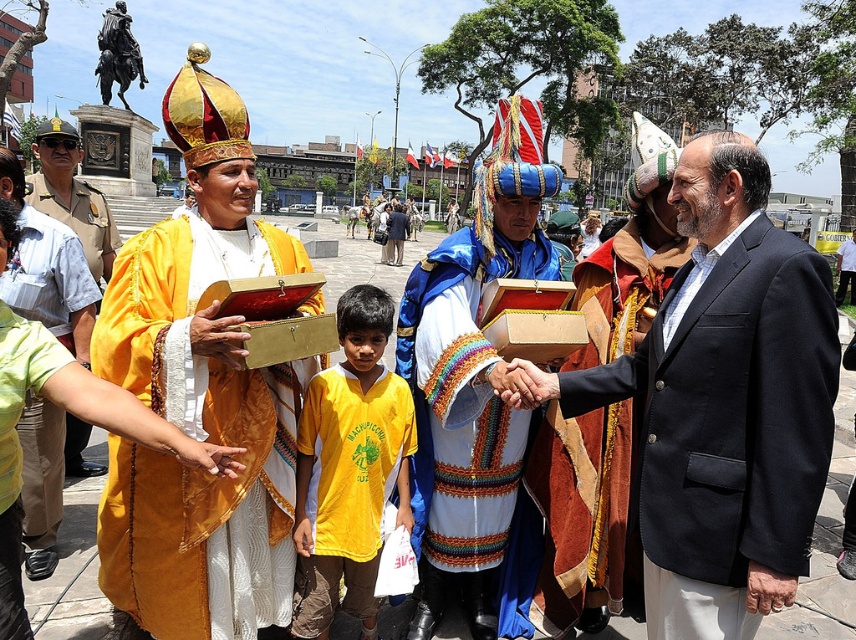
Looking at this image, you are an anthropologist studying the spatial arrangement of ceremonial attire in this image. The scene shows a matte gold robe at left and another figure in blue and white attire at right. Which object is positioned closer to the bottom edge of the image?

The matte gold robe at left is positioned closer to the bottom edge of the image as it is located at point (70, 195), which is lower than the other figure in blue and white attire at right.

Based on the photo, you are a photographer standing at the edge of the square. You want to take a photo that includes both the dark blue suit at center and the yellow jersey at center. The camera you are using has a maximum focus range of 25 feet. Will you be able to capture both subjects in focus without moving closer?

The distance between the dark blue suit at center and the yellow jersey at center is 26.44 feet, which exceeds the camera maximum focus range of 25 feet. Therefore, you will not be able to capture both subjects in focus without moving closer.

You are an anthropologist observing a cultural ceremony. You notice the matte gold robe at left and the yellow velvet robe at center. Which robe is shorter in height?

The matte gold robe at left is not as tall as the yellow velvet robe at center, so the matte gold robe at left is shorter in height.